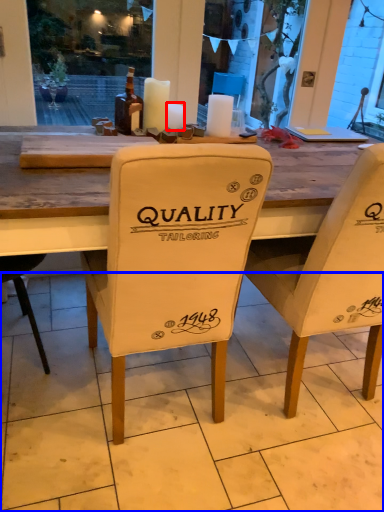
Question: Which object is closer to the camera taking this photo, candle (highlighted by a red box) or tile (highlighted by a blue box)?

Choices:
 (A) candle
 (B) tile

Answer: (B)